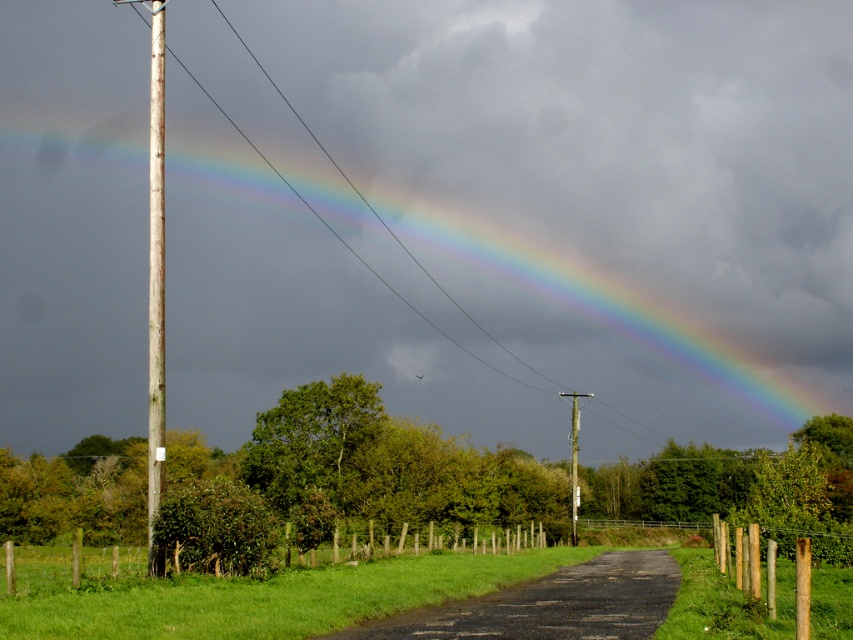
Is rainbow at upper center to the left of weathered wood pole at left from the viewer's perspective?

In fact, rainbow at upper center is to the right of weathered wood pole at left.

Who is lower down, rainbow at upper center or weathered wood pole at left?

weathered wood pole at left

The height and width of the screenshot is (640, 853). Describe the element at coordinates (515, 214) in the screenshot. I see `rainbow at upper center` at that location.

The height and width of the screenshot is (640, 853). Find the location of `rainbow at upper center`. rainbow at upper center is located at coordinates (515, 214).

Which of these two, black asphalt road at center or weathered wood pole at left, stands shorter?

black asphalt road at center

Who is positioned more to the left, black asphalt road at center or weathered wood pole at left?

weathered wood pole at left

Does point (572, 612) come closer to viewer compared to point (155, 26)?

Yes.

Where is `black asphalt road at center`? This screenshot has width=853, height=640. black asphalt road at center is located at coordinates (550, 604).

Which is more to the left, rainbow at upper center or wooden utility pole at center?

rainbow at upper center

Is rainbow at upper center smaller than wooden utility pole at center?

Incorrect, rainbow at upper center is not smaller in size than wooden utility pole at center.

The image size is (853, 640). Identify the location of rainbow at upper center. (515, 214).